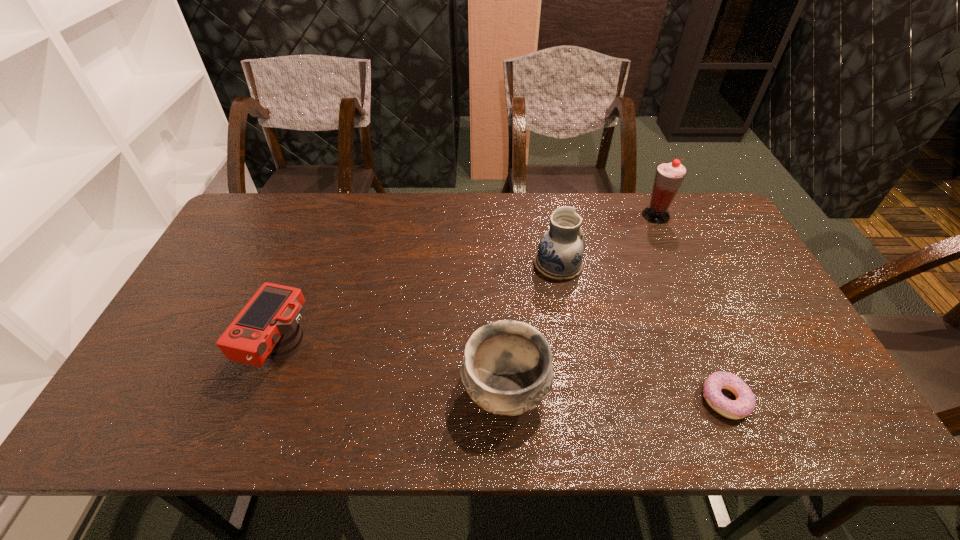
Image resolution: width=960 pixels, height=540 pixels. Identify the location of vacant area at the far right corner of the desktop. (690, 237).

Locate an element on the screen. The height and width of the screenshot is (540, 960). vacant area that lies between the farther pottery and the doughnut is located at coordinates (641, 332).

Locate an element on the screen. vacant area that lies between the nearer pottery and the tallest object is located at coordinates (581, 303).

This screenshot has height=540, width=960. I want to click on unoccupied area between the farther pottery and the leftmost object, so click(x=420, y=308).

This screenshot has width=960, height=540. I want to click on free space between the third object from left to right and the doughnut, so click(x=641, y=332).

You are a GUI agent. You are given a task and a screenshot of the screen. Output one action in this format:
    pyautogui.click(x=<x>, y=<y>)
    Task: Click on the vacant point located between the doughnut and the second object from left to right
    This screenshot has width=960, height=540.
    Given the screenshot: What is the action you would take?
    pyautogui.click(x=615, y=395)

I want to click on free space between the doughnut and the left pottery, so click(x=615, y=395).

Locate an element on the screen. The image size is (960, 540). vacant space that's between the camera and the smoothie is located at coordinates (469, 283).

Identify the location of vacant space that's between the farthest object and the taller pottery. The height and width of the screenshot is (540, 960). (607, 240).

The image size is (960, 540). Identify the location of empty space that is in between the fourth nearest object and the tallest object. (607, 240).